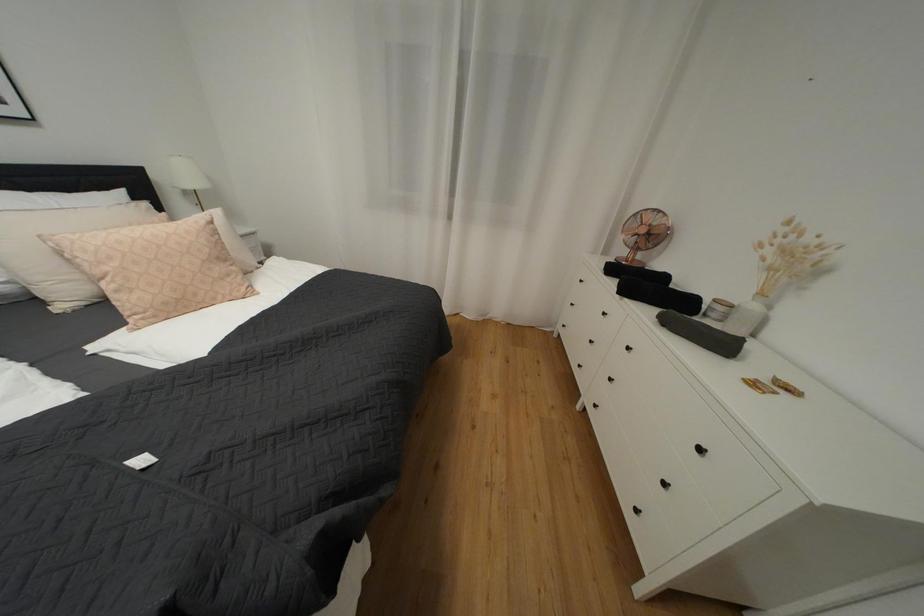
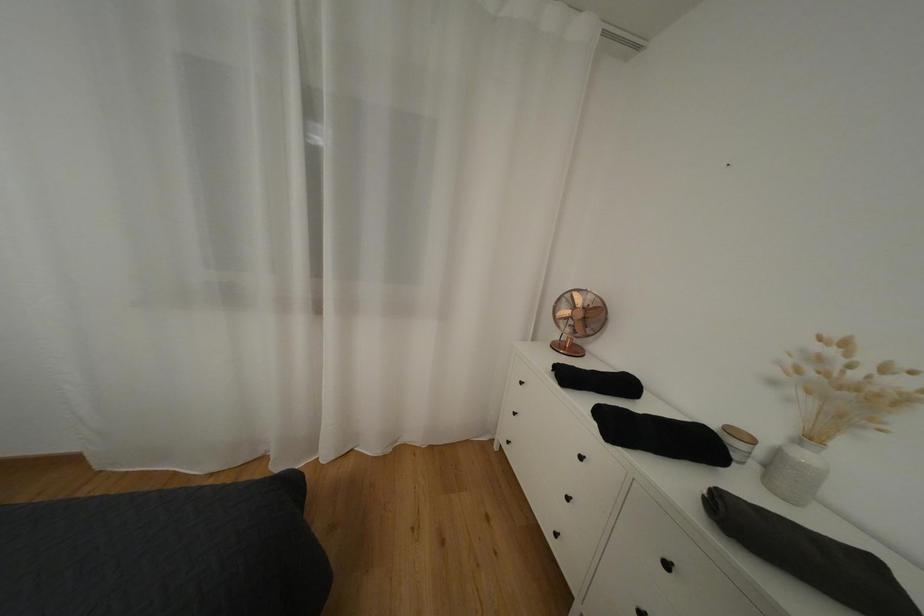
Question: Based on the continuous images, in which direction is the camera rotating? Reply with the corresponding letter.

Choices:
 (A) Left
 (B) Right
 (C) Up
 (D) Down

Answer: (B)